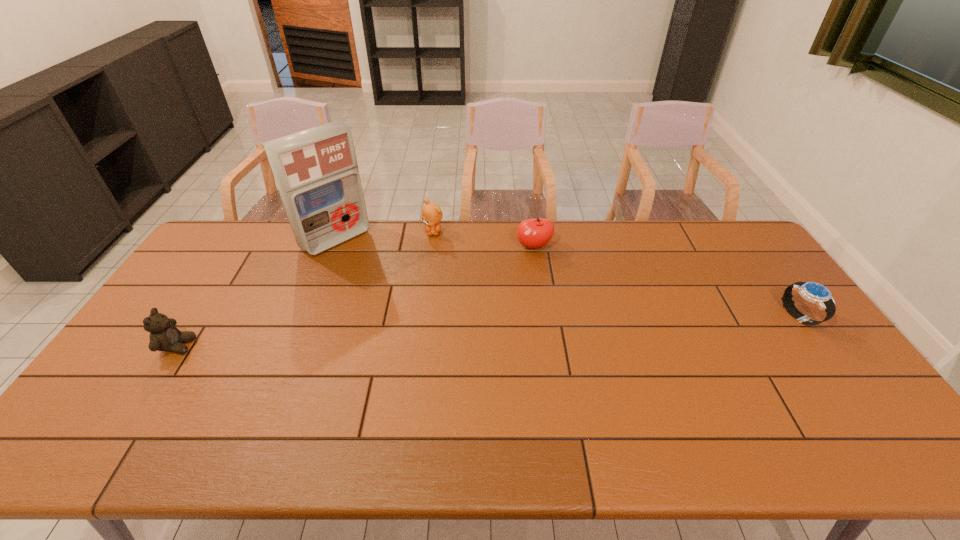
At what (x,y) coordinates should I click in order to perform the action: click on empty space that is in between the farther teddy bear and the first-aid kit. Please return your answer as a coordinate pair (x, y). This screenshot has height=540, width=960. Looking at the image, I should click on (385, 235).

Select which object appears as the fourth closest to the leftmost object. Please provide its 2D coordinates. Your answer should be formatted as a tuple, i.e. [(x, y)], where the tuple contains the x and y coordinates of a point satisfying the conditions above.

[(813, 292)]

Select which object appears as the fourth closest to the watch. Please provide its 2D coordinates. Your answer should be formatted as a tuple, i.e. [(x, y)], where the tuple contains the x and y coordinates of a point satisfying the conditions above.

[(164, 336)]

Find the location of a particular element. vacant space that satisfies the following two spatial constraints: 1. on the back side of the third object from right to left; 2. on the left side of the tallest object is located at coordinates (339, 232).